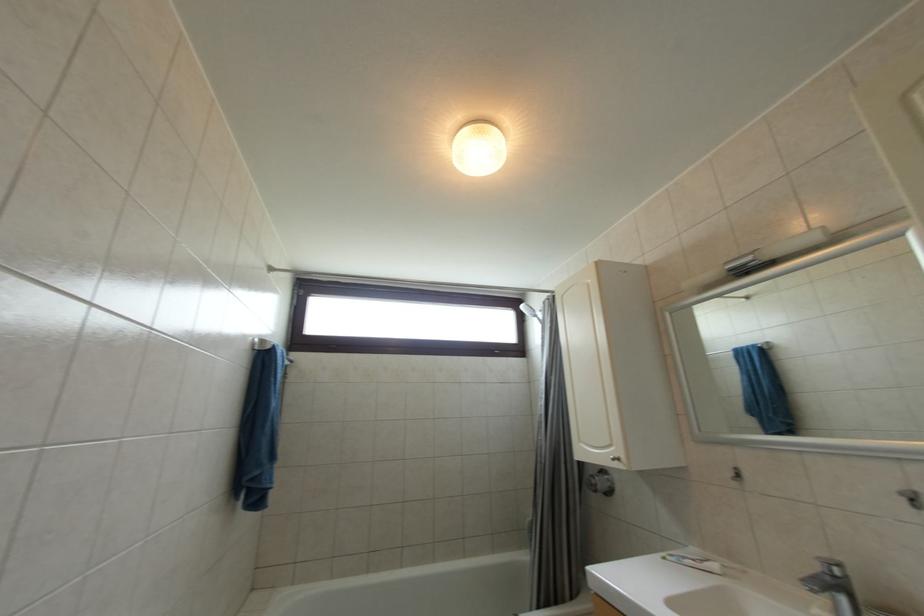
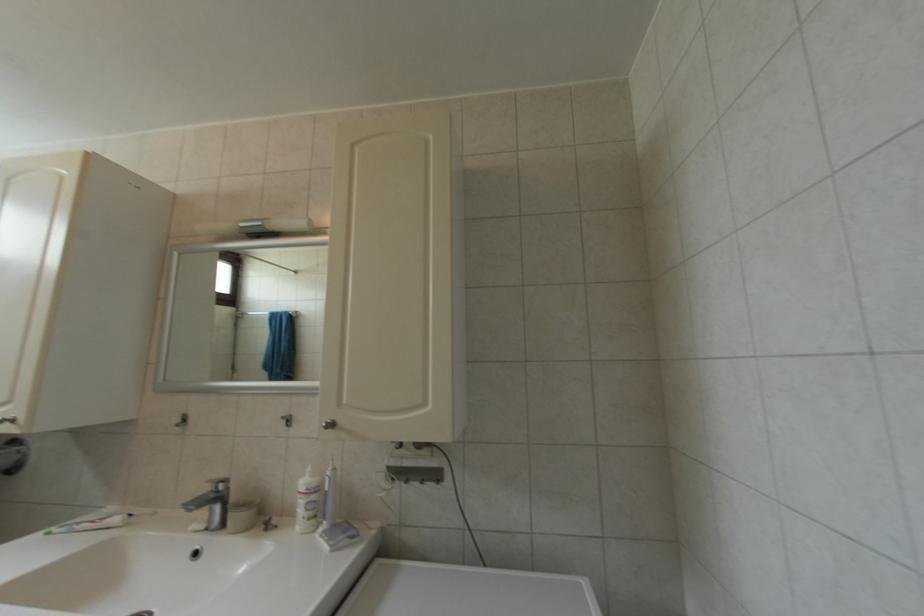
Question: Based on the continuous images, in which direction is the camera rotating? Reply with the corresponding letter.

Choices:
 (A) Left
 (B) Right
 (C) Up
 (D) Down

Answer: (B)